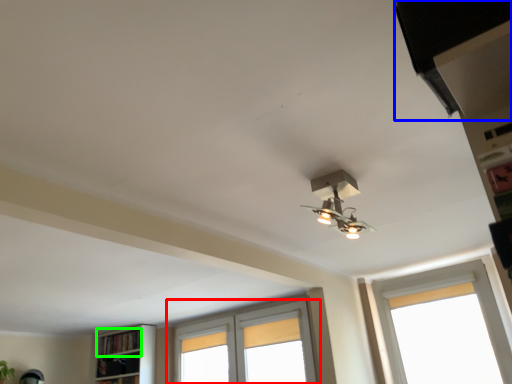
Question: Which object is positioned farthest from window (highlighted by a red box)? Select from exhaust hood (highlighted by a blue box) and shelf (highlighted by a green box).

Choices:
 (A) exhaust hood
 (B) shelf

Answer: (A)